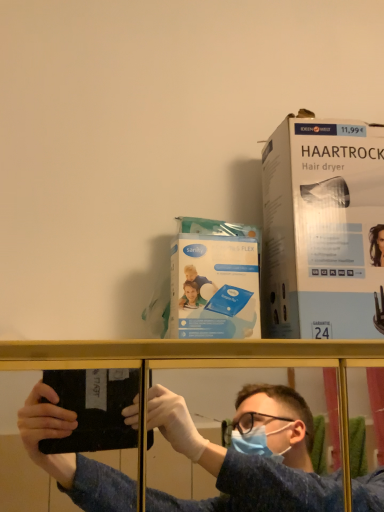
Question: From a real-world perspective, is blue fabric shirt at center beneath blue plastic sanitary pads at center, positioned as the 2th paperback book in right-to-left order?

Choices:
 (A) no
 (B) yes

Answer: (B)

Question: Is blue fabric shirt at center positioned in front of blue plastic sanitary pads at center, positioned as the 2th paperback book in right-to-left order?

Choices:
 (A) no
 (B) yes

Answer: (B)

Question: Considering the relative sizes of blue fabric shirt at center and blue plastic sanitary pads at center, positioned as the 2th paperback book in right-to-left order, in the image provided, is blue fabric shirt at center bigger than blue plastic sanitary pads at center, positioned as the 2th paperback book in right-to-left order,?

Choices:
 (A) no
 (B) yes

Answer: (B)

Question: Is blue fabric shirt at center not close to blue plastic sanitary pads at center, the first paperback book positioned from the left?

Choices:
 (A) yes
 (B) no

Answer: (B)

Question: Does blue fabric shirt at center appear on the right side of blue plastic sanitary pads at center, the first paperback book positioned from the left?

Choices:
 (A) yes
 (B) no

Answer: (B)

Question: From the image's perspective, is blue plastic sanitary pads at center, the first paperback book positioned from the left, positioned above or below white cardboard box at upper right, marked as the first paperback book in a right-to-left arrangement?

Choices:
 (A) below
 (B) above

Answer: (A)

Question: Is blue plastic sanitary pads at center, the first paperback book positioned from the left, taller or shorter than white cardboard box at upper right, the 2th paperback book in the left-to-right sequence?

Choices:
 (A) tall
 (B) short

Answer: (B)

Question: Is point (206, 236) closer or farther from the camera than point (382, 169)?

Choices:
 (A) farther
 (B) closer

Answer: (B)

Question: From a real-world perspective, is blue plastic sanitary pads at center, the first paperback book positioned from the left, physically located above or below white cardboard box at upper right, marked as the first paperback book in a right-to-left arrangement?

Choices:
 (A) above
 (B) below

Answer: (B)

Question: Relative to white cardboard box at upper right, the 2th paperback book in the left-to-right sequence, is blue fabric shirt at center in front or behind?

Choices:
 (A) behind
 (B) front

Answer: (B)

Question: Is blue fabric shirt at center wider or thinner than white cardboard box at upper right, the 2th paperback book in the left-to-right sequence?

Choices:
 (A) wide
 (B) thin

Answer: (A)

Question: Is blue fabric shirt at center inside or outside of white cardboard box at upper right, marked as the first paperback book in a right-to-left arrangement?

Choices:
 (A) inside
 (B) outside

Answer: (B)

Question: Does point (177, 502) appear closer or farther from the camera than point (292, 142)?

Choices:
 (A) closer
 (B) farther

Answer: (B)

Question: From a real-world perspective, is blue fabric shirt at center above or below blue plastic sanitary pads at center, the first paperback book positioned from the left?

Choices:
 (A) above
 (B) below

Answer: (B)

Question: From their relative heights in the image, would you say blue fabric shirt at center is taller or shorter than blue plastic sanitary pads at center, the first paperback book positioned from the left?

Choices:
 (A) short
 (B) tall

Answer: (B)